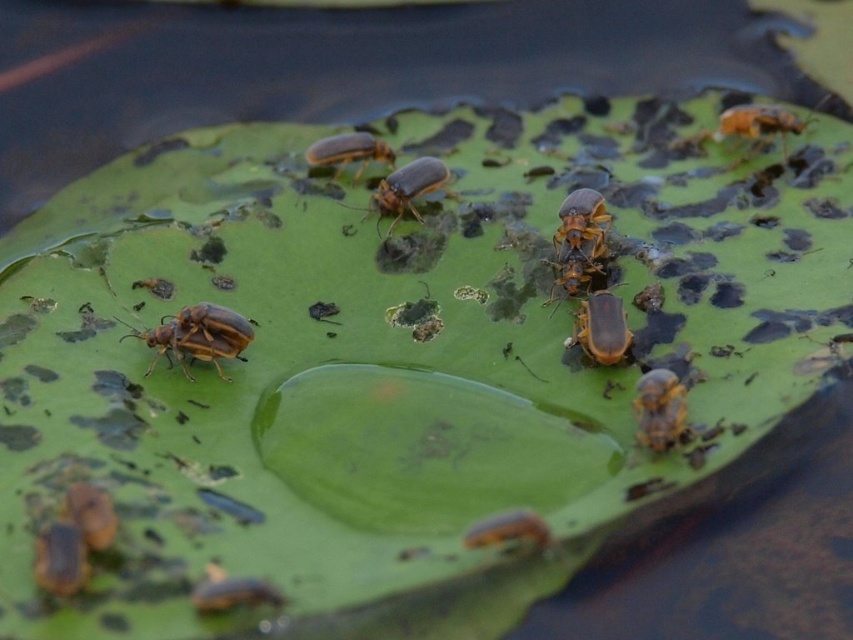
Question: Estimate the real-world distances between objects in this image. Which object is closer to the orange matte beetle at upper right?

Choices:
 (A) matte yellow beetle at center
 (B) orange matte beetle at center
 (C) brown matte beetle at center
 (D) yellow-orange glossy beetle at center

Answer: (B)

Question: Is orange matte beetle at center to the left of orange matte beetle at upper right from the viewer's perspective?

Choices:
 (A) no
 (B) yes

Answer: (B)

Question: Which point is farther to the camera?

Choices:
 (A) orange matte beetle at upper right
 (B) matte yellow beetle at center

Answer: (A)

Question: Is matte yellow beetle at center further to the viewer compared to orange matte beetle at upper right?

Choices:
 (A) yes
 (B) no

Answer: (B)

Question: Can you confirm if shiny golden beetle at bottom right is positioned above matte yellow beetle at center?

Choices:
 (A) yes
 (B) no

Answer: (B)

Question: Estimate the real-world distances between objects in this image. Which object is closer to the yellow-orange glossy beetle at center?

Choices:
 (A) orange matte beetle at upper right
 (B) yellow matte beetle at center
 (C) matte yellow beetle at center

Answer: (C)